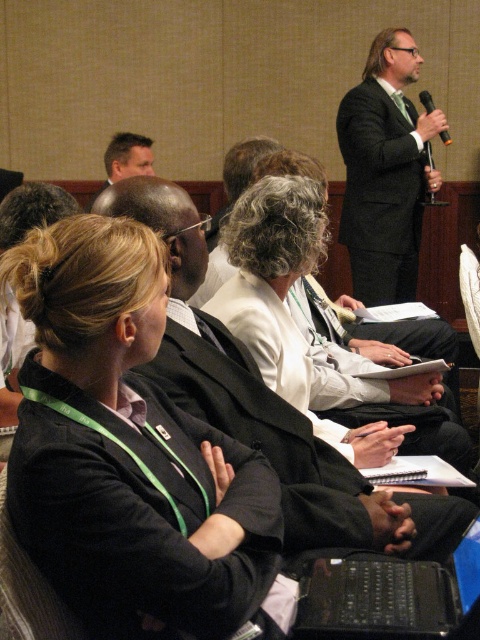
Can you confirm if black fabric jacket at center is shorter than white shirt at center?

Correct, black fabric jacket at center is not as tall as white shirt at center.

Looking at this image, is the position of black fabric jacket at center less distant than that of white shirt at center?

Yes, black fabric jacket at center is closer to the viewer.

Which is behind, point (36, 520) or point (267, 422)?

The point (267, 422) is behind.

This screenshot has width=480, height=640. Identify the location of black fabric jacket at center. (129, 452).

How distant is dark green textured suit at upper right from black plastic microphone at upper right?

41.64 centimeters

Between point (403, 68) and point (447, 140), which one is positioned behind?

The point (447, 140) is more distant.

Find the location of `dark green textured suit at upper right`. dark green textured suit at upper right is located at coordinates (385, 170).

Does dark green textured suit at upper right have a larger size compared to black plastic laptop at lower center?

Yes, dark green textured suit at upper right is bigger than black plastic laptop at lower center.

Who is positioned more to the right, dark green textured suit at upper right or black plastic laptop at lower center?

From the viewer's perspective, dark green textured suit at upper right appears more on the right side.

Locate an element on the screen. The image size is (480, 640). dark green textured suit at upper right is located at coordinates (385, 170).

Where is `dark green textured suit at upper right`? The height and width of the screenshot is (640, 480). dark green textured suit at upper right is located at coordinates (385, 170).